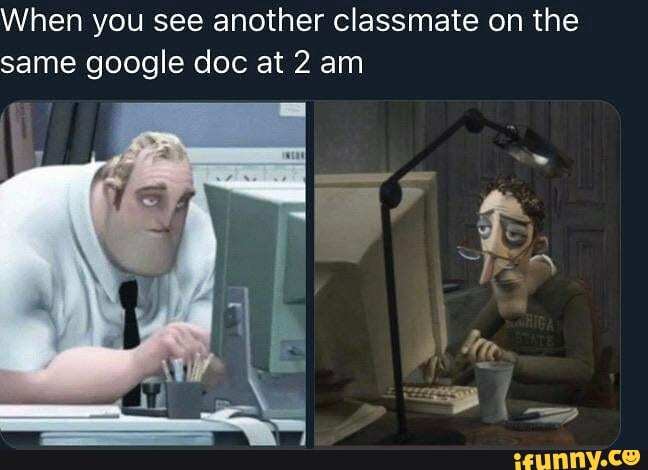
The height and width of the screenshot is (470, 648). What are the coordinates of `black desk lamp` in the screenshot? It's located at (394, 185).